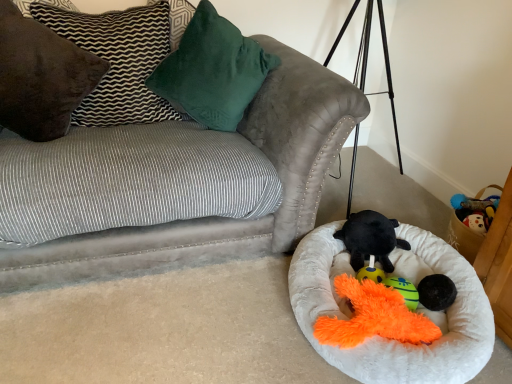
Locate an element on the screen. The height and width of the screenshot is (384, 512). vacant space situated on the left part of white fluffy dog bed at lower right is located at coordinates (206, 313).